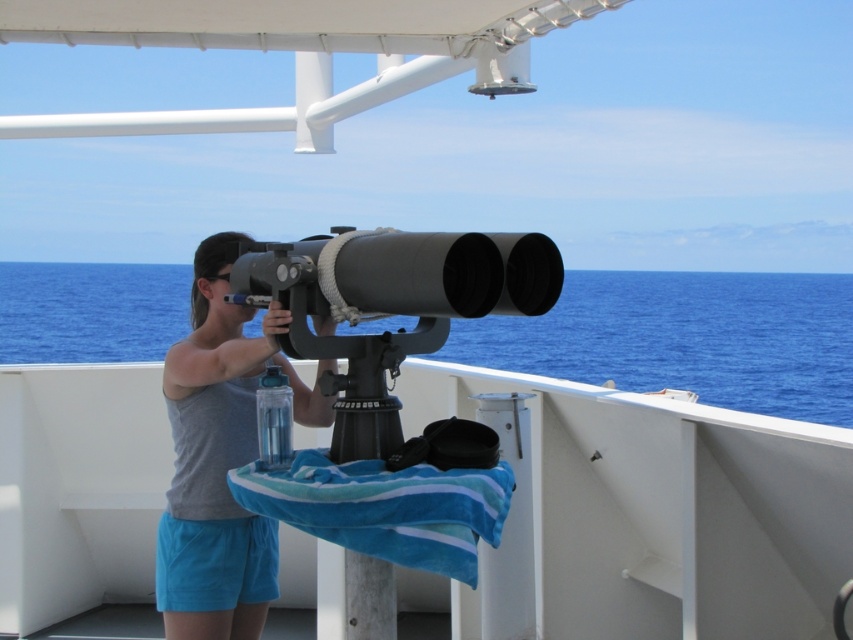
Can you confirm if gray matte tank top at center is wider than matte black telescope at center?

No.

Is gray matte tank top at center further to camera compared to matte black telescope at center?

Yes, gray matte tank top at center is further from the viewer.

Measure the distance between point (x=177, y=460) and camera.

Point (x=177, y=460) is 4.04 meters away from camera.

Locate an element on the screen. Image resolution: width=853 pixels, height=640 pixels. gray matte tank top at center is located at coordinates (219, 460).